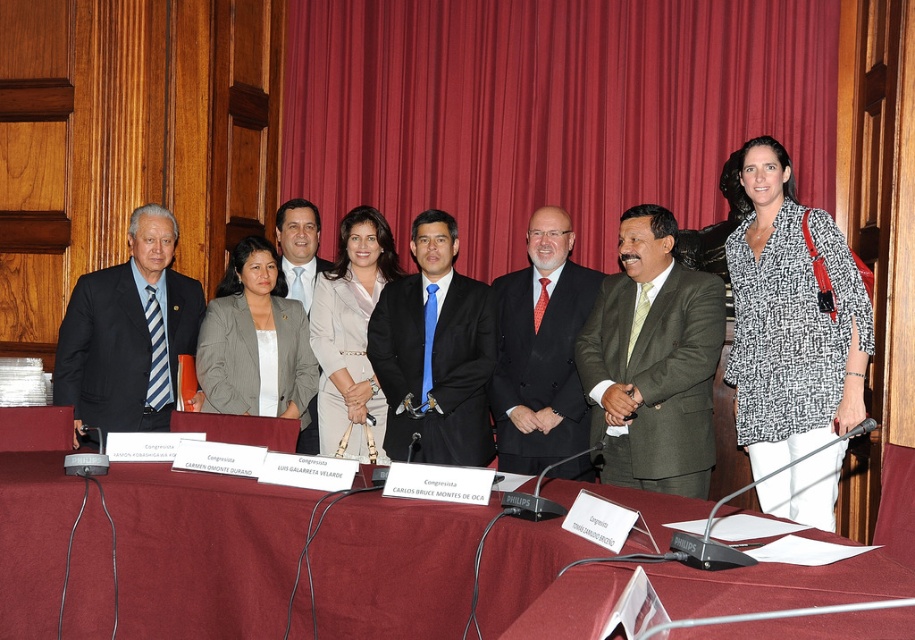
Between point (264, 595) and point (265, 282), which one is positioned behind?

Point (265, 282)

Is maroon fabric table at center positioned before matte gray blazer at center?

Yes, it is in front of matte gray blazer at center.

Between point (447, 604) and point (253, 262), which one is positioned behind?

Point (253, 262)

Locate an element on the screen. The image size is (915, 640). maroon fabric table at center is located at coordinates (203, 552).

Does printed cotton blouse at center have a lesser height compared to green textured suit at center?

No.

Is printed cotton blouse at center bigger than green textured suit at center?

Indeed, printed cotton blouse at center has a larger size compared to green textured suit at center.

Describe the element at coordinates (791, 317) in the screenshot. This screenshot has width=915, height=640. I see `printed cotton blouse at center` at that location.

Locate an element on the screen. printed cotton blouse at center is located at coordinates (791, 317).

You are a GUI agent. You are given a task and a screenshot of the screen. Output one action in this format:
    pyautogui.click(x=<x>, y=<y>)
    Task: Click on the maroon fabric table at center
    This screenshot has height=640, width=915.
    Given the screenshot: What is the action you would take?
    pos(203,552)

At what (x,y) coordinates should I click in order to perform the action: click on maroon fabric table at center. Please return your answer as a coordinate pair (x, y). Looking at the image, I should click on (203, 552).